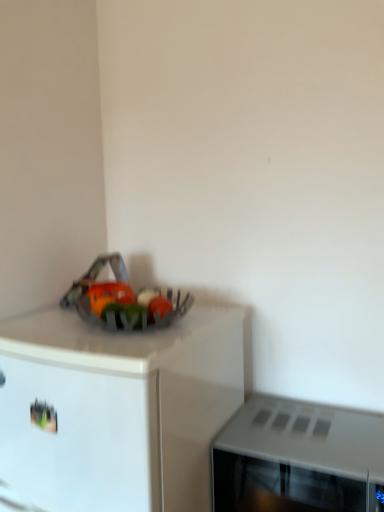
What do you see at coordinates (298, 458) in the screenshot? I see `gray matte microwave at right` at bounding box center [298, 458].

At what (x,y) coordinates should I click in order to perform the action: click on gray matte microwave at right. Please return your answer as a coordinate pair (x, y). This screenshot has height=512, width=384. Looking at the image, I should click on (298, 458).

What is the approximate height of gray matte microwave at right?

gray matte microwave at right is 10.00 inches in height.

This screenshot has width=384, height=512. I want to click on metallic silver bowl at upper left, so click(117, 409).

What do you see at coordinates (117, 409) in the screenshot? I see `metallic silver bowl at upper left` at bounding box center [117, 409].

This screenshot has height=512, width=384. What are the coordinates of `gray matte microwave at right` in the screenshot? It's located at (298, 458).

Which is more to the right, metallic silver bowl at upper left or gray matte microwave at right?

From the viewer's perspective, gray matte microwave at right appears more on the right side.

Considering their positions, is metallic silver bowl at upper left located in front of or behind gray matte microwave at right?

Clearly, metallic silver bowl at upper left is in front of gray matte microwave at right.

Considering the points (208, 407) and (285, 411), which point is behind, point (208, 407) or point (285, 411)?

The point (285, 411) is behind.

From the image's perspective, between metallic silver bowl at upper left and gray matte microwave at right, which one is located above?

From the image's view, gray matte microwave at right is above.

From a real-world perspective, is metallic silver bowl at upper left physically located above or below gray matte microwave at right?

Clearly, from a real-world perspective, metallic silver bowl at upper left is below gray matte microwave at right.

Which object is thinner, metallic silver bowl at upper left or gray matte microwave at right?

Thinner between the two is gray matte microwave at right.

Is metallic silver bowl at upper left taller or shorter than gray matte microwave at right?

In the image, metallic silver bowl at upper left appears to be taller than gray matte microwave at right.

Looking at this image, considering the relative sizes of metallic silver bowl at upper left and gray matte microwave at right in the image provided, is metallic silver bowl at upper left smaller than gray matte microwave at right?

Incorrect, metallic silver bowl at upper left is not smaller in size than gray matte microwave at right.

Choose the correct answer: Is metallic silver bowl at upper left inside gray matte microwave at right or outside it?

metallic silver bowl at upper left cannot be found inside gray matte microwave at right.

Are metallic silver bowl at upper left and gray matte microwave at right making contact?

metallic silver bowl at upper left is not next to gray matte microwave at right, and they're not touching.

Looking at this image, is metallic silver bowl at upper left looking in the opposite direction of gray matte microwave at right?

No, gray matte microwave at right is not at the back of metallic silver bowl at upper left.

At what (x,y) coordinates should I click in order to perform the action: click on cabinetry that appears below the gray matte microwave at right (from a real-world perspective). Please return your answer as a coordinate pair (x, y). The height and width of the screenshot is (512, 384). Looking at the image, I should click on (117, 409).

Is gray matte microwave at right at the left side of metallic silver bowl at upper left?

No, gray matte microwave at right is not to the left of metallic silver bowl at upper left.

In the image, is gray matte microwave at right positioned in front of or behind metallic silver bowl at upper left?

gray matte microwave at right is positioned farther from the viewer than metallic silver bowl at upper left.

Does point (225, 492) lie behind point (175, 397)?

Yes.

From the image's perspective, relative to metallic silver bowl at upper left, is gray matte microwave at right above or below?

Based on their image positions, gray matte microwave at right is located above metallic silver bowl at upper left.

From a real-world perspective, does gray matte microwave at right sit lower than metallic silver bowl at upper left?

No, from a real-world perspective, gray matte microwave at right is not beneath metallic silver bowl at upper left.

Is gray matte microwave at right wider or thinner than metallic silver bowl at upper left?

Considering their sizes, gray matte microwave at right looks slimmer than metallic silver bowl at upper left.

Does gray matte microwave at right have a greater height compared to metallic silver bowl at upper left?

No, gray matte microwave at right is not taller than metallic silver bowl at upper left.

Considering the sizes of objects gray matte microwave at right and metallic silver bowl at upper left in the image provided, who is smaller, gray matte microwave at right or metallic silver bowl at upper left?

With smaller size is gray matte microwave at right.

Would you say gray matte microwave at right is outside metallic silver bowl at upper left?

That's correct, gray matte microwave at right is outside of metallic silver bowl at upper left.

Is gray matte microwave at right not close to metallic silver bowl at upper left?

No.

Is gray matte microwave at right turned away from metallic silver bowl at upper left?

No.

What's the angular difference between gray matte microwave at right and metallic silver bowl at upper left's facing directions?

gray matte microwave at right and metallic silver bowl at upper left are facing 1.53 degrees away from each other.

Measure the distance from gray matte microwave at right to metallic silver bowl at upper left.

gray matte microwave at right is 10.44 inches from metallic silver bowl at upper left.

Locate an element on the screen. cabinetry located in front of the gray matte microwave at right is located at coordinates (117, 409).

Locate an element on the screen. This screenshot has height=512, width=384. microwave oven behind the metallic silver bowl at upper left is located at coordinates (298, 458).

This screenshot has width=384, height=512. In order to click on microwave oven above the metallic silver bowl at upper left (from the image's perspective) in this screenshot , I will do `click(298, 458)`.